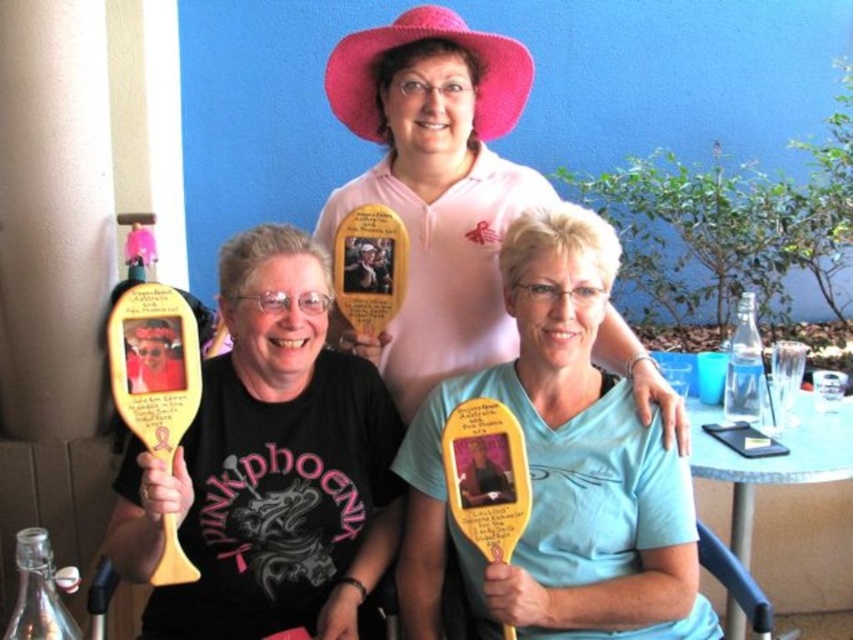
Question: Does pink matte hat at upper center have a smaller size compared to blue plastic table at lower right?

Choices:
 (A) no
 (B) yes

Answer: (A)

Question: Considering the real-world distances, which object is closest to the transparent glass bottle at lower left?

Choices:
 (A) light blue fabric shirt at center
 (B) blue plastic table at lower right
 (C) pink matte hat at upper center

Answer: (A)

Question: Does transparent glass bottle at lower left have a lesser width compared to clear glass bottle at right?

Choices:
 (A) no
 (B) yes

Answer: (A)

Question: Can you confirm if blue plastic table at lower right is wider than transparent glass bottle at lower left?

Choices:
 (A) yes
 (B) no

Answer: (A)

Question: Which object appears closest to the camera in this image?

Choices:
 (A) pink matte hat at upper center
 (B) blue plastic table at lower right

Answer: (A)

Question: Based on their relative distances, which object is farther from the blue plastic table at lower right?

Choices:
 (A) matte wooden paddle at center
 (B) light blue fabric shirt at center
 (C) transparent glass bottle at lower left
 (D) clear glass bottle at right

Answer: (C)